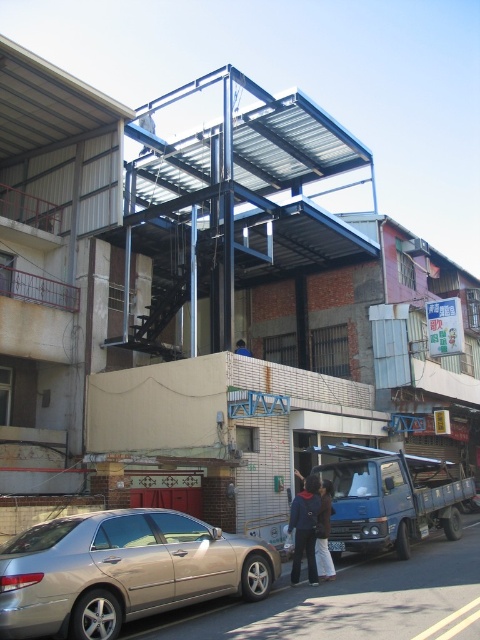
Question: Among these points, which one is farthest from the camera?

Choices:
 (A) (299, 568)
 (B) (326, 484)
 (C) (238, 344)

Answer: (C)

Question: Does gold metallic car at lower left appear under blue fabric bag at center?

Choices:
 (A) yes
 (B) no

Answer: (A)

Question: Estimate the real-world distances between objects in this image. Which object is farther from the blue fabric bag at center?

Choices:
 (A) dark brown leather jacket at center
 (B) dark blue jacket at center

Answer: (B)

Question: Does gold metallic car at lower left come behind dark brown leather jacket at center?

Choices:
 (A) yes
 (B) no

Answer: (B)

Question: Can you confirm if dark blue jacket at center is positioned to the left of dark brown leather jacket at center?

Choices:
 (A) no
 (B) yes

Answer: (B)

Question: Which of the following is the closest to the observer?

Choices:
 (A) (241, 342)
 (B) (321, 547)
 (C) (143, 600)
 (D) (303, 531)

Answer: (C)